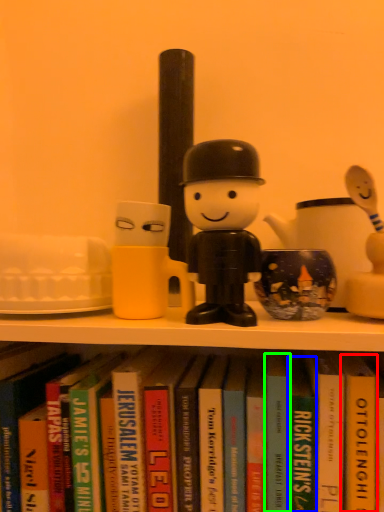
Question: Based on their relative distances, which object is farther from paperback book (highlighted by a red box)? Choose from paperback book (highlighted by a blue box) and paperback book (highlighted by a green box).

Choices:
 (A) paperback book
 (B) paperback book

Answer: (B)